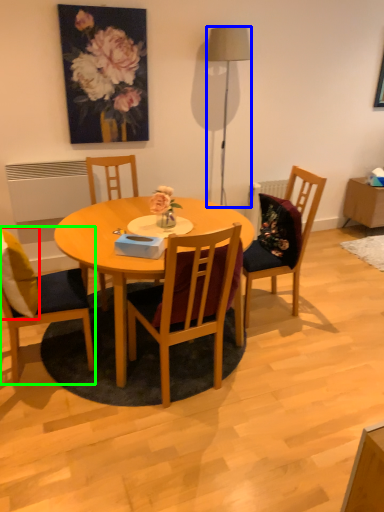
Question: Which object is the farthest from pillow (highlighted by a red box)? Choose among these: lamp (highlighted by a blue box) or chair (highlighted by a green box).

Choices:
 (A) lamp
 (B) chair

Answer: (A)